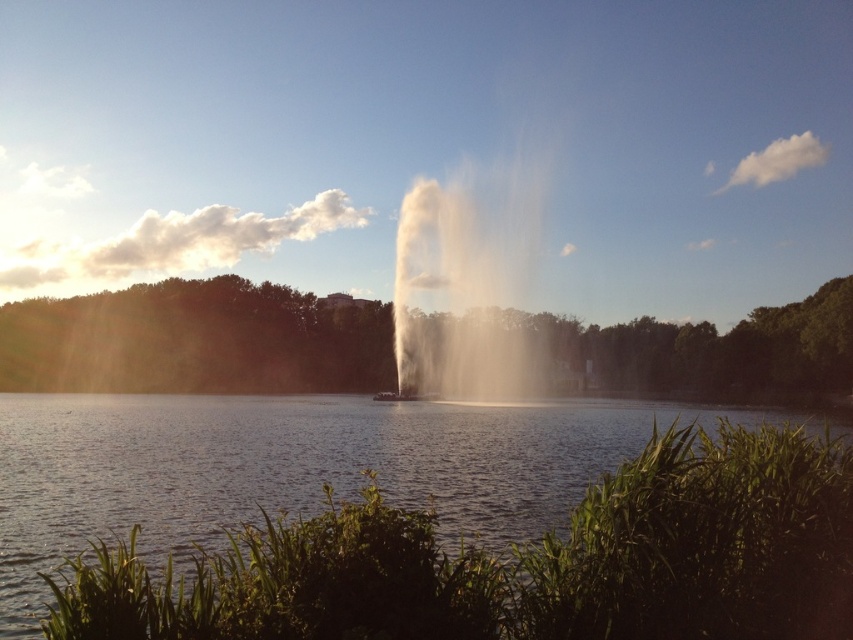
You are a photographer wanting to capture the white misty fountain at center and the green leafy tree at left in the same frame. Based on their positions, which object will appear closer to the bottom of your photo?

The green leafy tree at left is below the white misty fountain at center, so it will appear closer to the bottom of the photo.

You are a photographer trying to capture the white misty fountain at center and the transparent water at center in a single shot. Based on their positions, where should you position the fountain in relation to the water to ensure both are in frame?

The transparent water at center is to the left of white misty fountain at center. To capture both in a single shot, position the white misty fountain at center to the right of the transparent water at center so they are aligned horizontally.